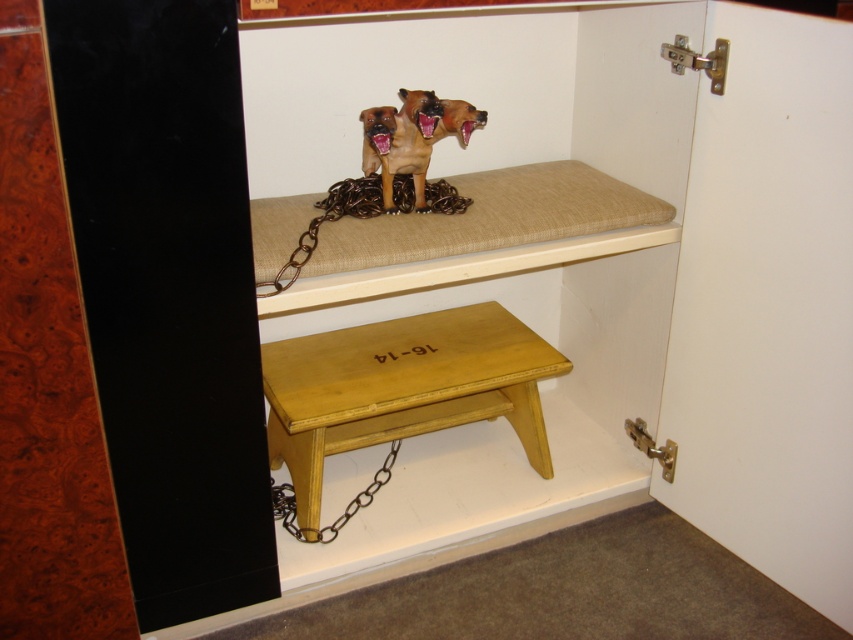
Question: Is yellow wood step stool at lower center smaller than metallic chain at lower center?

Choices:
 (A) yes
 (B) no

Answer: (B)

Question: Which point is closer to the camera?

Choices:
 (A) (387, 467)
 (B) (339, 211)
 (C) (309, 484)

Answer: (B)

Question: Can you confirm if yellow wood step stool at lower center is positioned to the left of brown metallic chain at upper center?

Choices:
 (A) no
 (B) yes

Answer: (A)

Question: Does yellow wood step stool at lower center have a larger size compared to metallic chain at lower center?

Choices:
 (A) yes
 (B) no

Answer: (A)

Question: Which object is closer to the camera taking this photo?

Choices:
 (A) yellow wood step stool at lower center
 (B) brown matte dog at upper center

Answer: (B)

Question: Which of these objects is positioned closest to the metallic chain at lower center?

Choices:
 (A) brown metallic chain at upper center
 (B) yellow wood step stool at lower center

Answer: (B)